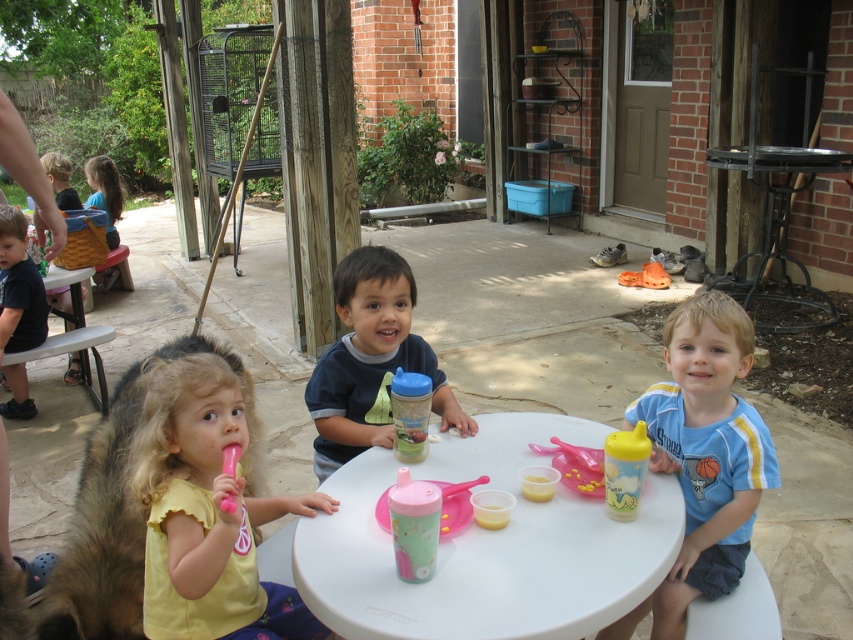
You are standing in the backyard and want to reach the point at coordinates (346,508). If you take a step forward of 1.5 meters, will you be able to touch that point?

The point at coordinates (346,508) is 1.67 meters away from the viewer. Taking a step forward of 1.5 meters would bring you to 0.17 meters away from the point, so yes, you can touch it.

Consider the image. You are a parent trying to place a new snack on the table. Where should you place it to ensure it is between the black metal picnic table at right and the yellow plastic cup at center?

The black metal picnic table at right is positioned on the right side of the yellow plastic cup at center, so placing the snack between them would require placing it to the left of the black metal picnic table at right and to the right of the yellow plastic cup at center.

You are a parent trying to reach for the yellow rubber sippy cup at center while sitting at the white plastic table at center. Can you easily grab it without moving your seat?

The white plastic table at center is in front of the yellow rubber sippy cup at center, so the sippy cup is behind the table. Since you are sitting at the table, the cup would be out of reach unless you move your seat forward or stand up.